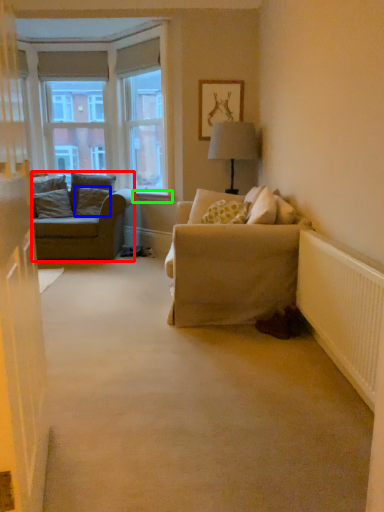
Question: Which is farther away from studio couch (highlighted by a red box)? pillow (highlighted by a blue box) or window sill (highlighted by a green box)?

Choices:
 (A) pillow
 (B) window sill

Answer: (B)